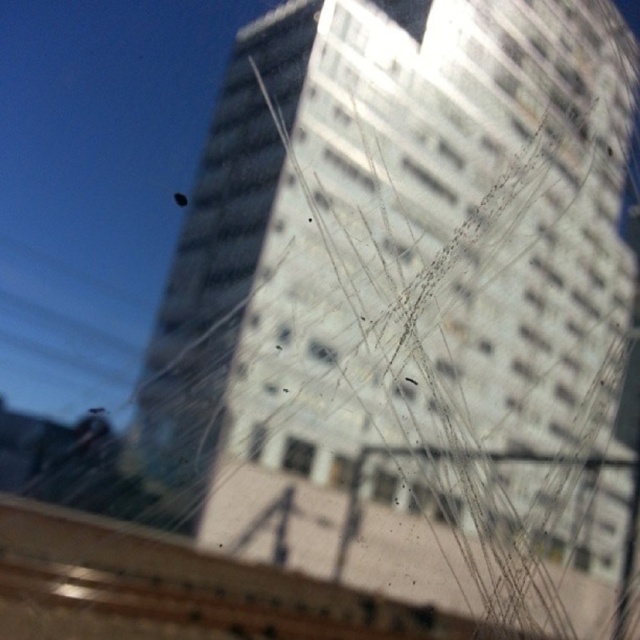
Question: Among these points, which one is farthest from the camera?

Choices:
 (A) (381, 481)
 (B) (305, 477)

Answer: (A)

Question: Can you confirm if clear glass window at center is positioned below transparent glass window at center?

Choices:
 (A) no
 (B) yes

Answer: (A)

Question: Which object is closer to the camera taking this photo?

Choices:
 (A) clear glass window at center
 (B) transparent glass window at center

Answer: (A)

Question: Is the position of clear glass window at center more distant than that of transparent glass window at center?

Choices:
 (A) yes
 (B) no

Answer: (B)

Question: Can you confirm if clear glass window at center is positioned to the left of transparent glass window at center?

Choices:
 (A) yes
 (B) no

Answer: (A)